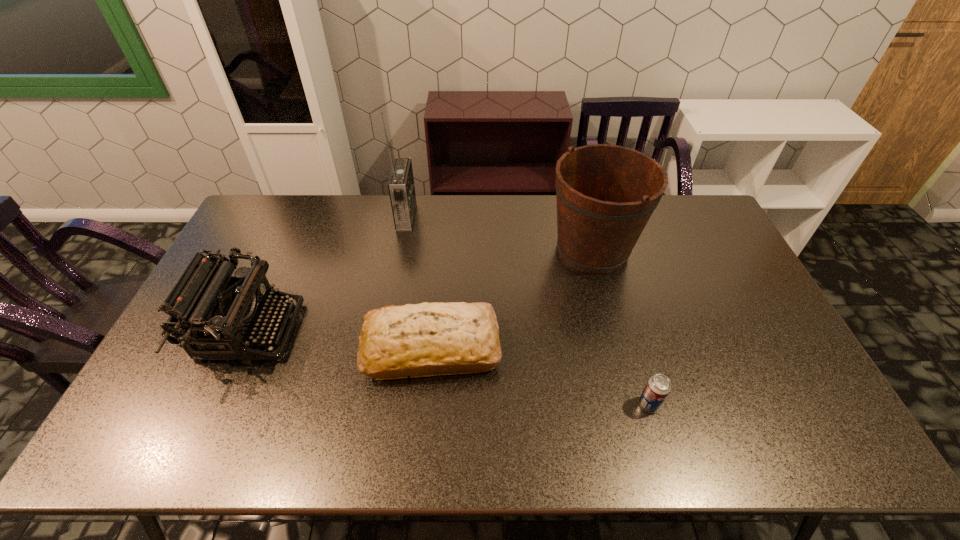
This screenshot has height=540, width=960. I want to click on object identified as the third closest to the beer can, so click(401, 187).

The image size is (960, 540). In order to click on object that is the fourth closest to the tallest object in this screenshot , I will do `click(658, 387)`.

Identify the location of vacant space that satisfies the following two spatial constraints: 1. on the keyboard of the leftmost object; 2. on the left side of the fourth tallest object. The height and width of the screenshot is (540, 960). (243, 348).

Find the location of a particular element. This screenshot has width=960, height=540. free point that satisfies the following two spatial constraints: 1. on the display of the nearest object; 2. on the right side of the radio receiver is located at coordinates (372, 404).

The width and height of the screenshot is (960, 540). Find the location of `vacant point that satisfies the following two spatial constraints: 1. on the display of the tallest object; 2. on the right side of the nearest object`. vacant point that satisfies the following two spatial constraints: 1. on the display of the tallest object; 2. on the right side of the nearest object is located at coordinates (372, 404).

You are a GUI agent. You are given a task and a screenshot of the screen. Output one action in this format:
    pyautogui.click(x=<x>, y=<y>)
    Task: Click on the free space that satisfies the following two spatial constraints: 1. on the back side of the second shortest object; 2. on the display of the tallest object
    The width and height of the screenshot is (960, 540).
    Given the screenshot: What is the action you would take?
    pyautogui.click(x=444, y=217)

Locate an element on the screen. vacant point that satisfies the following two spatial constraints: 1. on the keyboard of the typewriter; 2. on the left side of the fourth tallest object is located at coordinates (243, 348).